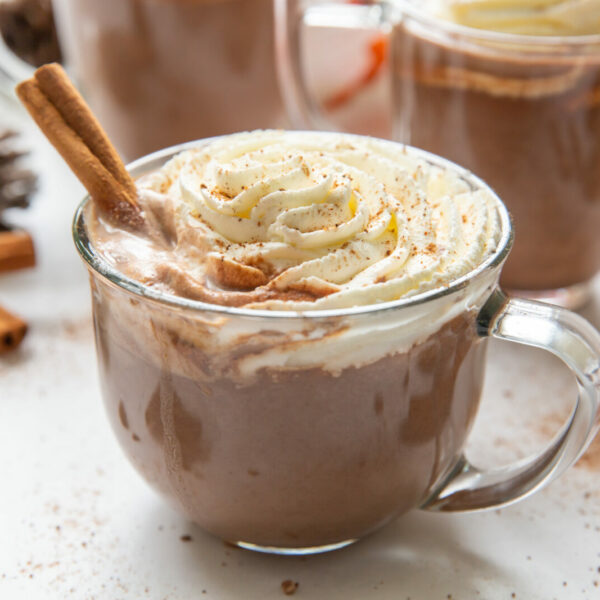
This screenshot has height=600, width=600. I want to click on handle, so click(529, 479).